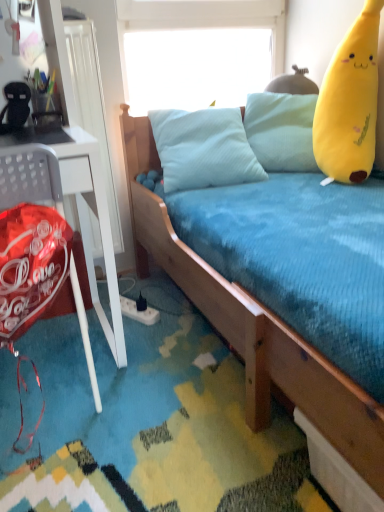
This screenshot has height=512, width=384. What are the coordinates of `vacant space to the right of shiny red balloon at left` in the screenshot? It's located at (150, 373).